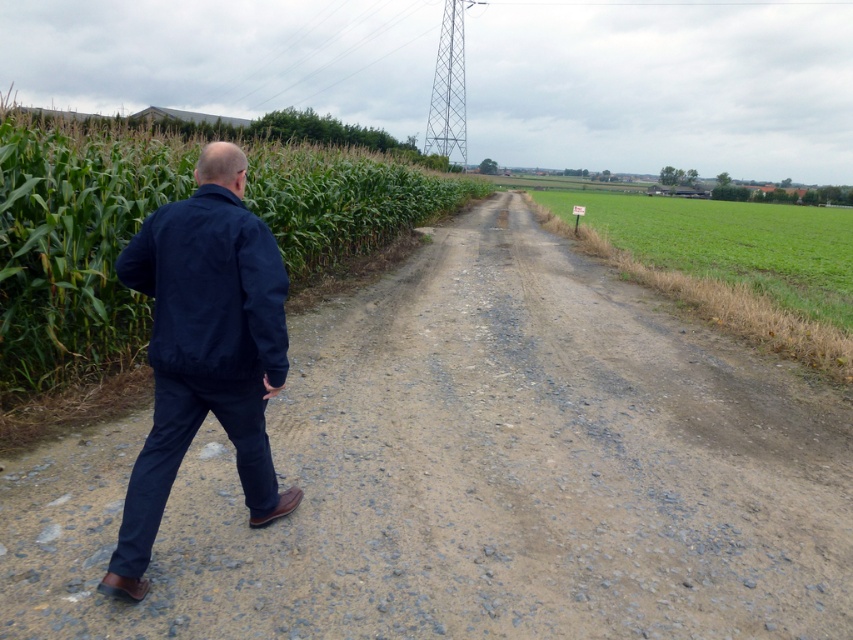
You are a hiker who wants to know if you can see the metallic tower at upper center from the dull gray gravel at center. Based on their heights, can you see it?

The dull gray gravel at center has a lesser height compared to metallic tower at upper center, so yes, you can see the metallic tower at upper center from the dull gray gravel at center because it is taller.

You are a hiker who wants to take a photo of the metallic tower at upper center. You are standing on the dull gray gravel at center. Which direction should you move to get a clearer view of the tower?

Since the dull gray gravel at center is closer to the viewer than the metallic tower at upper center, you should move forward away from the gravel towards the tower to get a clearer view.